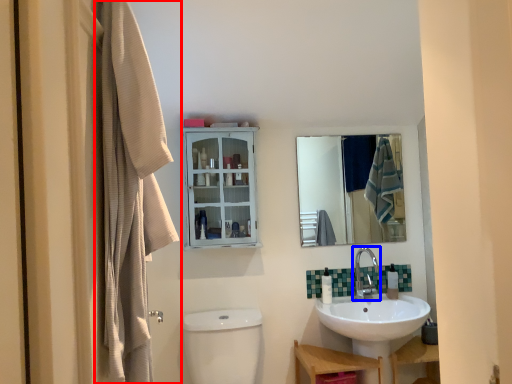
Question: Which object is closer to the camera taking this photo, curtain (highlighted by a red box) or tap (highlighted by a blue box)?

Choices:
 (A) curtain
 (B) tap

Answer: (A)